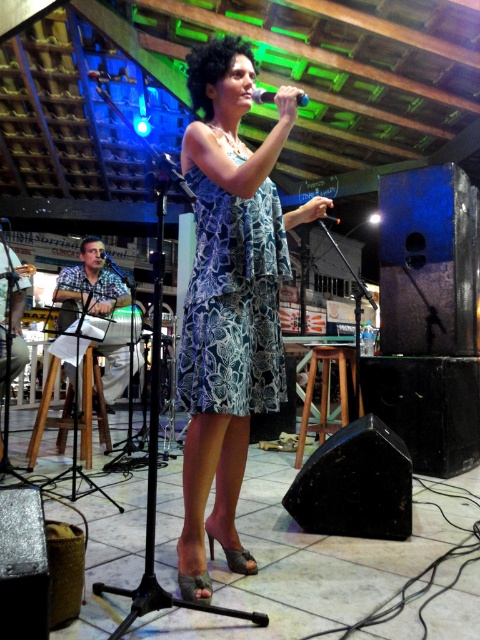
Question: Is blue floral dress at center further to the viewer compared to metallic silver microphone at upper center?

Choices:
 (A) no
 (B) yes

Answer: (B)

Question: Is blue floral dress at center closer to camera compared to wooden stool at center?

Choices:
 (A) yes
 (B) no

Answer: (A)

Question: Which object appears closest to the camera in this image?

Choices:
 (A) blue printed fabric dress at center
 (B) blue floral dress at center

Answer: (B)

Question: Which object appears closest to the camera in this image?

Choices:
 (A) wooden stool at lower left
 (B) metallic silver microphone at upper center
 (C) blue printed fabric dress at center

Answer: (B)

Question: Which point is farther to the camera?

Choices:
 (A) pos(267,292)
 (B) pos(46,378)

Answer: (B)

Question: Does blue floral dress at center appear on the right side of wooden stool at center?

Choices:
 (A) no
 (B) yes

Answer: (A)